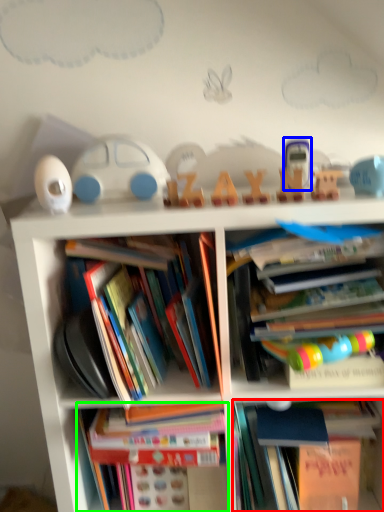
Question: Which is farther away from book (highlighted by a red box)? toy (highlighted by a blue box) or book (highlighted by a green box)?

Choices:
 (A) toy
 (B) book

Answer: (A)